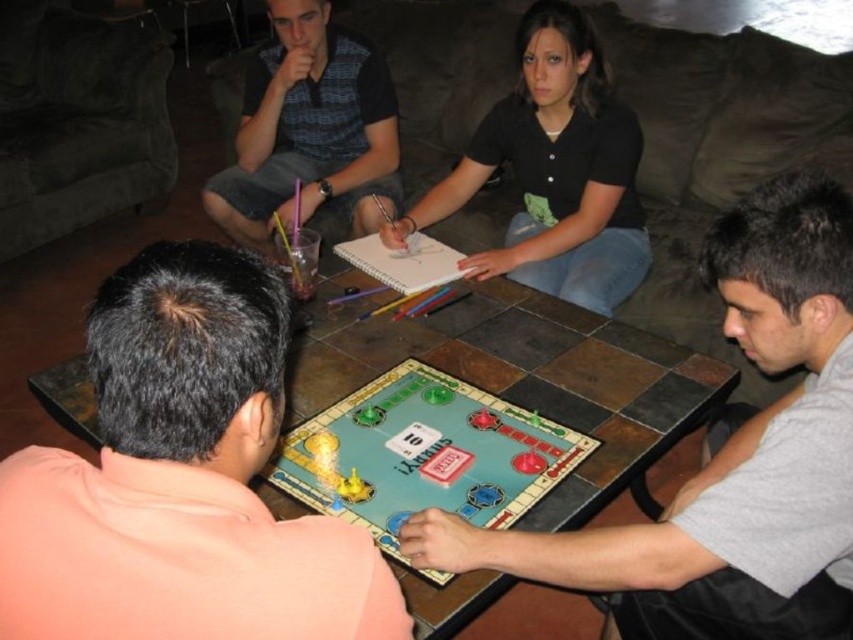
Question: Does gray fabric shirt at center appear on the right side of plaid shirt at upper center?

Choices:
 (A) yes
 (B) no

Answer: (A)

Question: Which point is closer to the camera?

Choices:
 (A) plaid shirt at upper center
 (B) tile-patterned table at center
 (C) gray fabric shirt at center
 (D) black matte shirt at center

Answer: (C)

Question: Is tile-patterned table at center to the right of black matte shirt at center from the viewer's perspective?

Choices:
 (A) yes
 (B) no

Answer: (B)

Question: Can you confirm if brown fabric couch at upper center is smaller than plaid shirt at upper center?

Choices:
 (A) no
 (B) yes

Answer: (A)

Question: Which point is farther to the camera?

Choices:
 (A) black matte shirt at center
 (B) light blue plastic board game at center
 (C) plaid shirt at upper center

Answer: (C)

Question: Which point is closer to the camera taking this photo?

Choices:
 (A) (567, 419)
 (B) (378, 468)
 (C) (461, 237)
 (D) (595, 192)

Answer: (B)